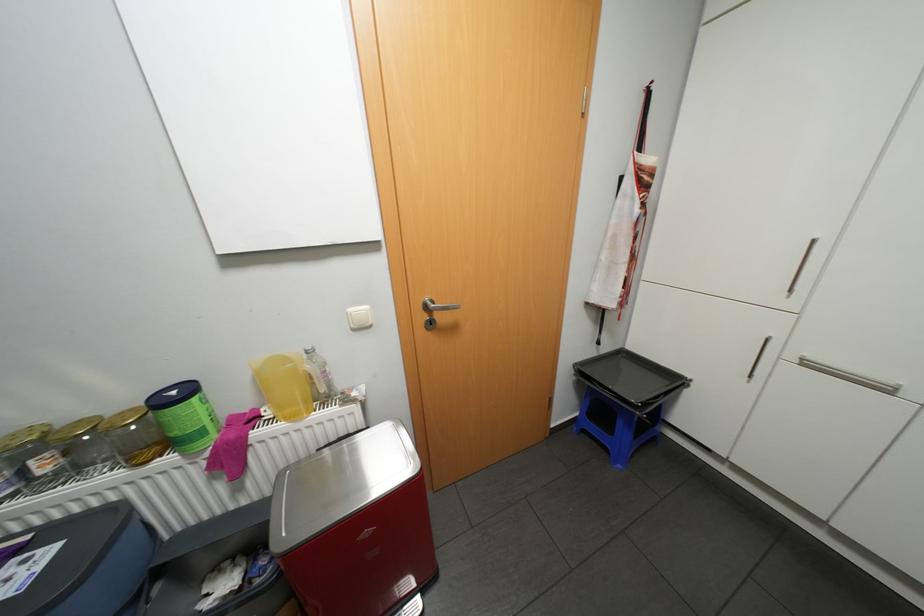
Identify the location of trash can foot pedal. (410, 607).